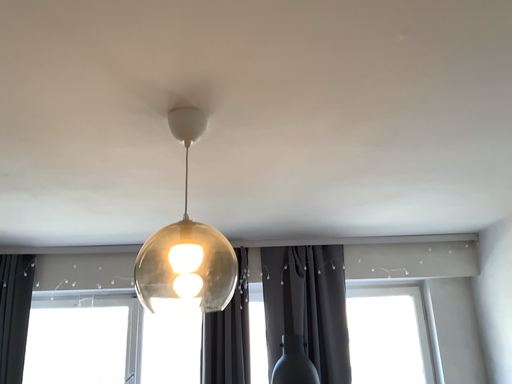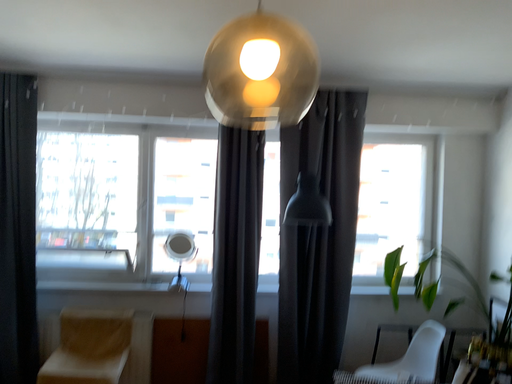
Question: Which way did the camera rotate in the video?

Choices:
 (A) rotated upward
 (B) rotated downward

Answer: (B)